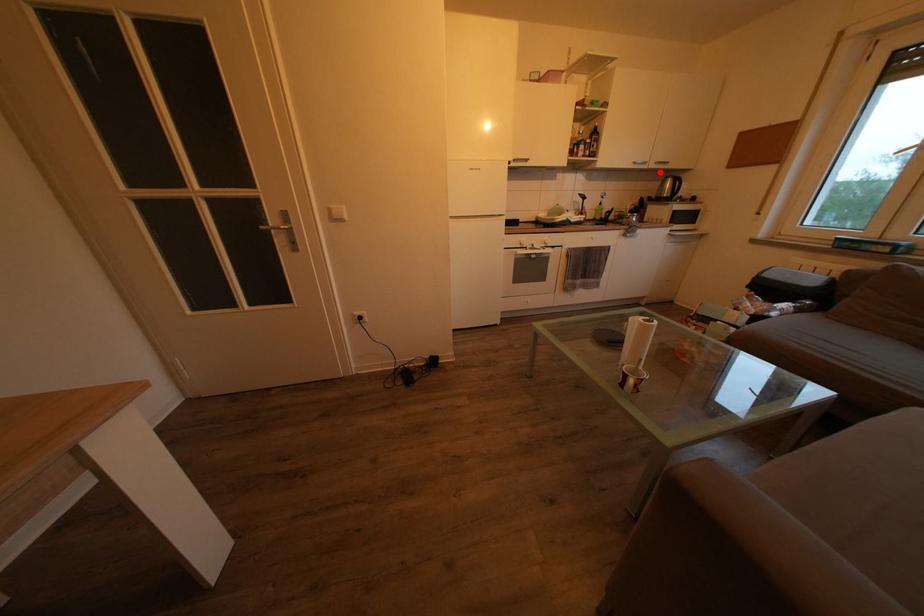
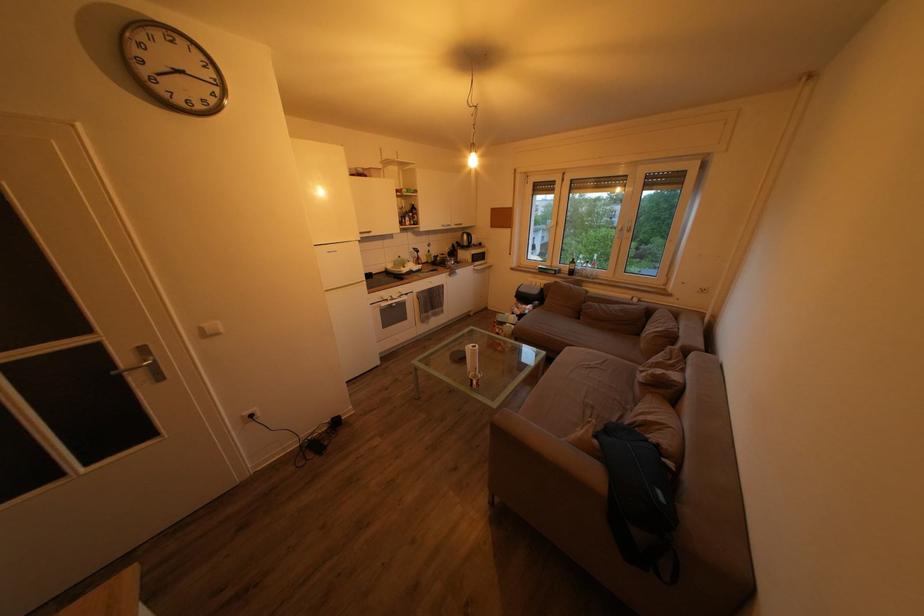
In the second image, find the point that corresponds to the highlighted location in the first image.

(462, 233)